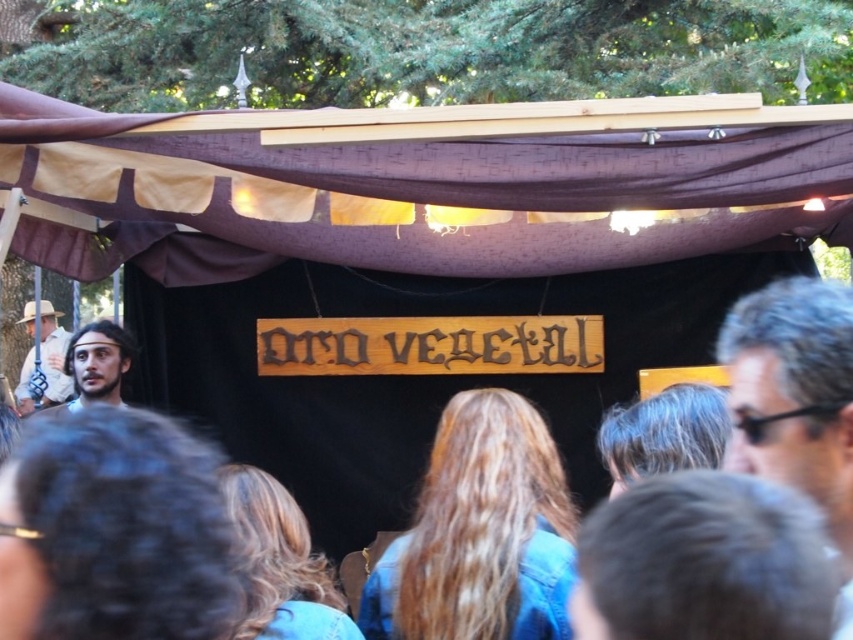
Between brown fabric canopy at upper center and smooth brown hair at center, which one is positioned lower?

smooth brown hair at center

Can you confirm if brown fabric canopy at upper center is taller than smooth brown hair at center?

Indeed, brown fabric canopy at upper center has a greater height compared to smooth brown hair at center.

Who is more distant from viewer, [811,109] or [103,356]?

Point [103,356]

You are a GUI agent. You are given a task and a screenshot of the screen. Output one action in this format:
    pyautogui.click(x=<x>, y=<y>)
    Task: Click on the brown fabric canopy at upper center
    The height and width of the screenshot is (640, 853).
    Given the screenshot: What is the action you would take?
    pyautogui.click(x=421, y=184)

Is point (810, 492) closer to camera compared to point (61, 365)?

Yes, it is in front of point (61, 365).

Does gray hair at right have a lesser width compared to matte brown hat at left?

Correct, gray hair at right's width is less than matte brown hat at left's.

At what (x,y) coordinates should I click in order to perform the action: click on gray hair at right. Please return your answer as a coordinate pair (x, y). This screenshot has height=640, width=853. Looking at the image, I should click on (796, 401).

Locate an element on the screen. Image resolution: width=853 pixels, height=640 pixels. gray hair at right is located at coordinates (796, 401).

Is brown fabric canopy at upper center smaller than gray hair at right?

No.

Is brown fabric canopy at upper center positioned behind gray hair at right?

Yes, it is behind gray hair at right.

Locate an element on the screen. Image resolution: width=853 pixels, height=640 pixels. brown fabric canopy at upper center is located at coordinates (421, 184).